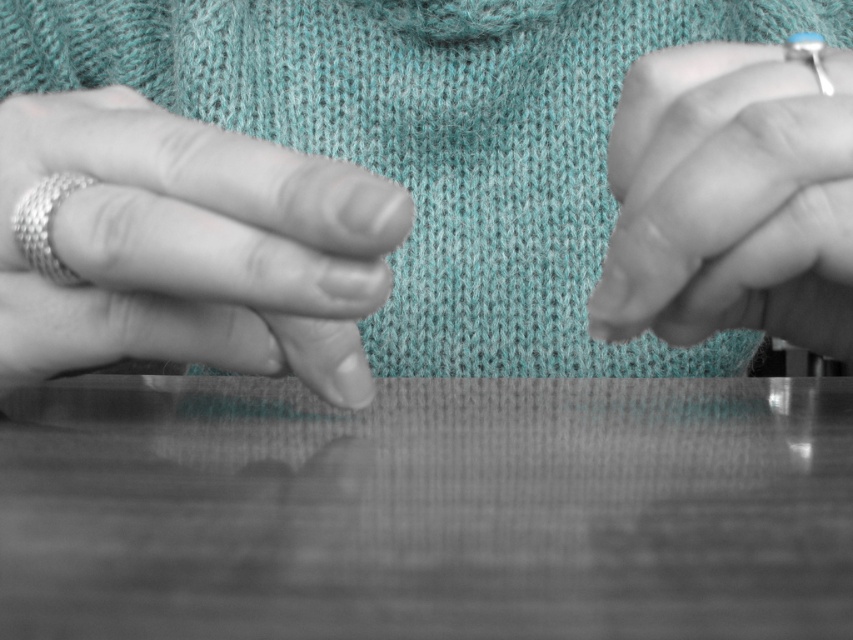
Question: Is metallic ring at left thinner than silver woven ring at left?

Choices:
 (A) no
 (B) yes

Answer: (A)

Question: Which point is farther to the camera?

Choices:
 (A) (16, 138)
 (B) (33, 250)
 (C) (53, 170)
 (D) (816, 141)

Answer: (A)

Question: Can you confirm if metallic ring at left is positioned above silver woven ring at left?

Choices:
 (A) no
 (B) yes

Answer: (A)

Question: Among these objects, which one is nearest to the camera?

Choices:
 (A) matte silver ring at center
 (B) silver metallic ring at upper right
 (C) silver woven ring at left

Answer: (A)

Question: Does matte silver ring at center appear under metallic ring at left?

Choices:
 (A) yes
 (B) no

Answer: (B)

Question: Among these points, which one is farthest from the camera?

Choices:
 (A) (146, 241)
 (B) (142, 180)
 (C) (701, 147)

Answer: (C)